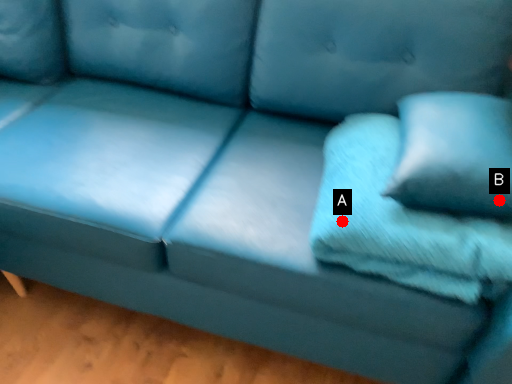
Question: Two points are circled on the image, labeled by A and B beside each circle. Which point is closer to the camera?

Choices:
 (A) A is closer
 (B) B is closer

Answer: (B)